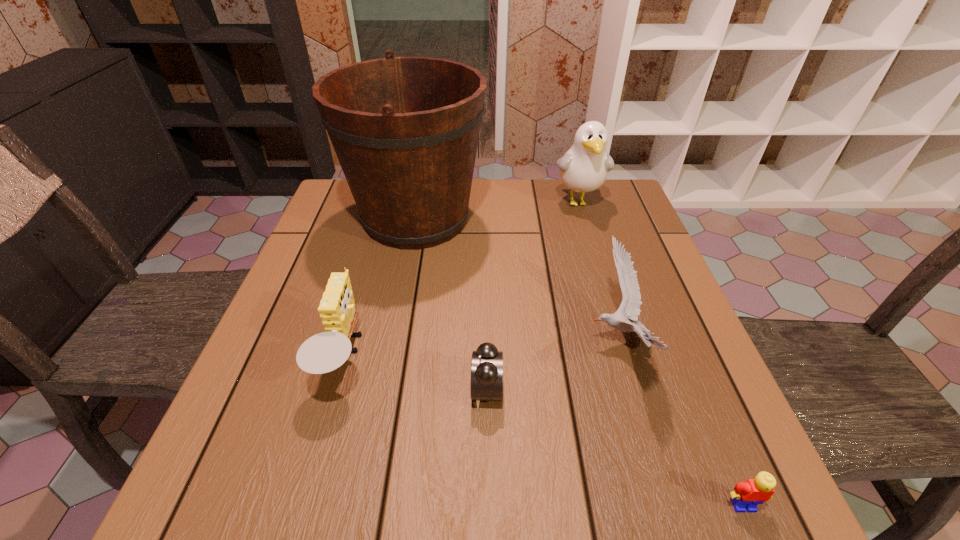
You are a GUI agent. You are given a task and a screenshot of the screen. Output one action in this format:
    pyautogui.click(x=<x>, y=<y>)
    Task: Click on the free region located 0.350m at the tip of the beak of the shorter gull
    The height and width of the screenshot is (540, 960).
    Given the screenshot: What is the action you would take?
    pyautogui.click(x=416, y=341)

At what (x,y) coordinates should I click in order to perform the action: click on free location located 0.280m at the tip of the beak of the shorter gull. Please return your answer as a coordinate pair (x, y). This screenshot has height=540, width=960. Looking at the image, I should click on (450, 341).

I want to click on vacant space located at the tip of the beak of the shorter gull, so click(x=500, y=341).

The width and height of the screenshot is (960, 540). What are the coordinates of `free space located on the front-facing side of the sponge` in the screenshot? It's located at (x=450, y=356).

At what (x,y) coordinates should I click in order to perform the action: click on vacant space located on the front side of the alarm clock. Please return your answer as a coordinate pair (x, y). The image size is (960, 540). Looking at the image, I should click on (350, 390).

Where is `vacant space located 0.370m on the front side of the alarm clock`? The width and height of the screenshot is (960, 540). vacant space located 0.370m on the front side of the alarm clock is located at coordinates [269, 390].

I want to click on vacant area situated on the front side of the alarm clock, so click(x=328, y=390).

Where is `bucket that is at the far edge`? The image size is (960, 540). bucket that is at the far edge is located at coordinates (405, 130).

Find the location of a particular element. This screenshot has width=960, height=540. gull present at the far edge is located at coordinates (584, 168).

The height and width of the screenshot is (540, 960). What are the coordinates of `object present at the near edge` in the screenshot? It's located at (747, 495).